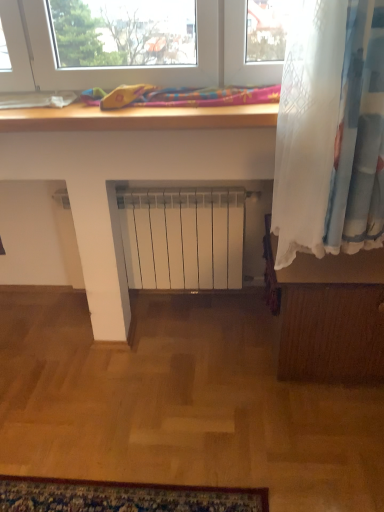
What do you see at coordinates (207, 97) in the screenshot? I see `multicolored fabric at upper center` at bounding box center [207, 97].

Locate an element on the screen. The height and width of the screenshot is (512, 384). multicolored fabric at upper center is located at coordinates (207, 97).

The width and height of the screenshot is (384, 512). Find the location of `wooden floorboard at right`. wooden floorboard at right is located at coordinates (329, 315).

Describe the element at coordinates (329, 315) in the screenshot. I see `wooden floorboard at right` at that location.

This screenshot has width=384, height=512. Find the location of `multicolored fabric at upper center`. multicolored fabric at upper center is located at coordinates (207, 97).

Is multicolored fabric at upper center at the right side of wooden floorboard at right?

No, multicolored fabric at upper center is not to the right of wooden floorboard at right.

Which is in front, multicolored fabric at upper center or wooden floorboard at right?

multicolored fabric at upper center.

Does point (156, 98) appear closer or farther from the camera than point (327, 365)?

Point (156, 98) is closer to the camera than point (327, 365).

From the image's perspective, relative to wooden floorboard at right, is multicolored fabric at upper center above or below?

Based on their image positions, multicolored fabric at upper center is located above wooden floorboard at right.

From a real-world perspective, between multicolored fabric at upper center and wooden floorboard at right, who is vertically higher?

multicolored fabric at upper center is physically above.

Is multicolored fabric at upper center thinner than wooden floorboard at right?

Correct, the width of multicolored fabric at upper center is less than that of wooden floorboard at right.

Does multicolored fabric at upper center have a lesser height compared to wooden floorboard at right?

Yes.

In terms of size, does multicolored fabric at upper center appear bigger or smaller than wooden floorboard at right?

Considering their sizes, multicolored fabric at upper center takes up less space than wooden floorboard at right.

Would you say multicolored fabric at upper center is inside or outside wooden floorboard at right?

multicolored fabric at upper center exists outside the volume of wooden floorboard at right.

Is multicolored fabric at upper center not close to wooden floorboard at right?

No, multicolored fabric at upper center is not far from wooden floorboard at right.

Is multicolored fabric at upper center aimed at wooden floorboard at right?

No, multicolored fabric at upper center is not oriented towards wooden floorboard at right.

Where is `bedding in front of the wooden floorboard at right`? This screenshot has height=512, width=384. bedding in front of the wooden floorboard at right is located at coordinates (207, 97).

Can you confirm if wooden floorboard at right is positioned to the left of multicolored fabric at upper center?

No.

Considering their positions, is wooden floorboard at right located in front of or behind multicolored fabric at upper center?

wooden floorboard at right is behind multicolored fabric at upper center.

Which point is more forward, (297, 263) or (138, 102)?

Positioned in front is point (138, 102).

From the image's perspective, does wooden floorboard at right appear lower than multicolored fabric at upper center?

Indeed, from the image's perspective, wooden floorboard at right is shown beneath multicolored fabric at upper center.

From a real-world perspective, is wooden floorboard at right located higher than multicolored fabric at upper center?

Incorrect, from a real-world perspective, wooden floorboard at right is lower than multicolored fabric at upper center.

Does wooden floorboard at right have a lesser width compared to multicolored fabric at upper center?

No, wooden floorboard at right is not thinner than multicolored fabric at upper center.

Does wooden floorboard at right have a lesser height compared to multicolored fabric at upper center?

No.

In the scene shown: Is wooden floorboard at right smaller than multicolored fabric at upper center?

Actually, wooden floorboard at right might be larger than multicolored fabric at upper center.

Is wooden floorboard at right not within multicolored fabric at upper center?

Yes, wooden floorboard at right is located beyond the bounds of multicolored fabric at upper center.

Would you say wooden floorboard at right is a long distance from multicolored fabric at upper center?

No, there isn't a large distance between wooden floorboard at right and multicolored fabric at upper center.

Is wooden floorboard at right aimed at multicolored fabric at upper center?

No, wooden floorboard at right is not turned towards multicolored fabric at upper center.

How far apart are wooden floorboard at right and multicolored fabric at upper center?

wooden floorboard at right is 32.40 inches away from multicolored fabric at upper center.

Find the location of `furniture below the multicolored fabric at upper center (from the image's perspective)`. furniture below the multicolored fabric at upper center (from the image's perspective) is located at coordinates (329, 315).

Find the location of a particular element. This screenshot has height=512, width=384. furniture located behind the multicolored fabric at upper center is located at coordinates (329, 315).

The height and width of the screenshot is (512, 384). I want to click on bedding on the left of the wooden floorboard at right, so click(207, 97).